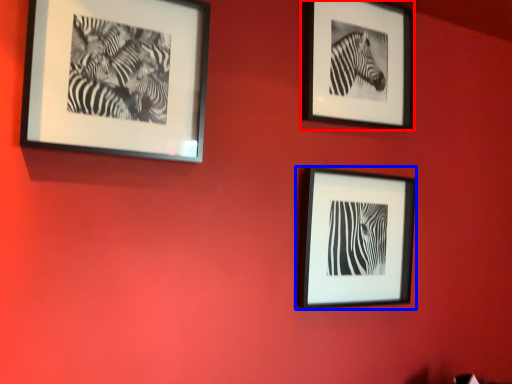
Question: Which object appears closest to the camera in this image, picture frame (highlighted by a red box) or picture frame (highlighted by a blue box)?

Choices:
 (A) picture frame
 (B) picture frame

Answer: (B)